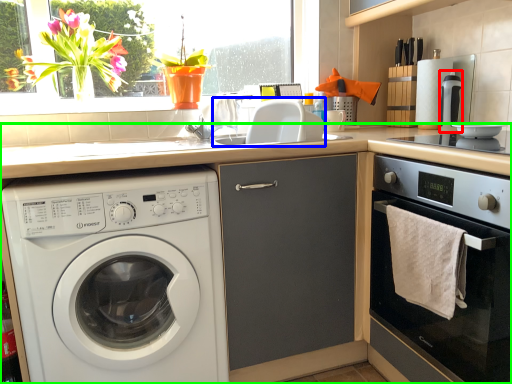
Question: Considering the real-world distances, which object is farthest from coffee machine (highlighted by a red box)? sink (highlighted by a blue box) or countertop (highlighted by a green box)?

Choices:
 (A) sink
 (B) countertop

Answer: (B)